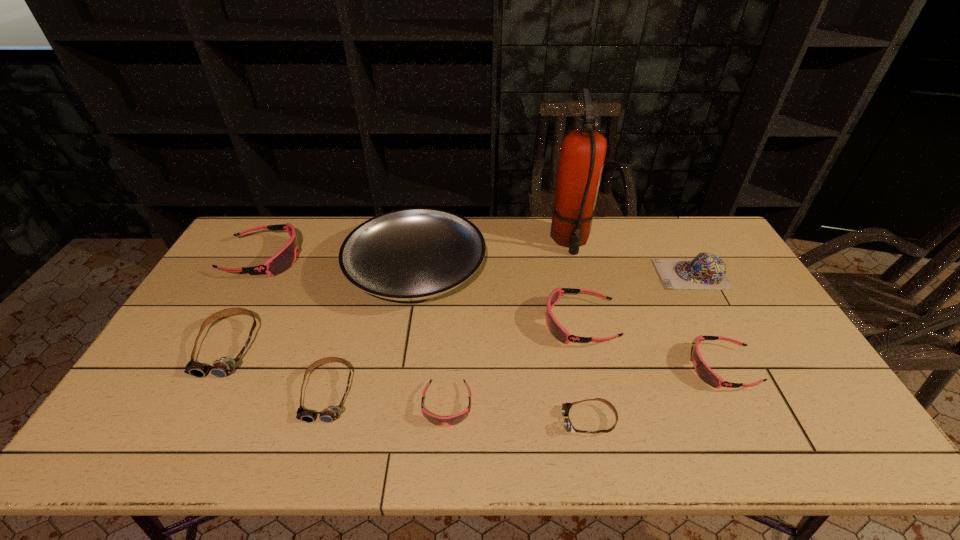
What are the coordinates of `the tallest object` in the screenshot? It's located at (583, 151).

Image resolution: width=960 pixels, height=540 pixels. I want to click on bedpan, so pyautogui.click(x=410, y=254).

In order to click on the biggest pink goggles in this screenshot , I will do tap(284, 259).

What are the coordinates of `the farthest pink goggles` in the screenshot? It's located at (284, 259).

The height and width of the screenshot is (540, 960). In order to click on cap in this screenshot , I will do `click(707, 271)`.

At what (x,y) coordinates should I click in order to perform the action: click on the third smallest pink goggles. Please return your answer as a coordinate pair (x, y). The height and width of the screenshot is (540, 960). Looking at the image, I should click on (557, 330).

Find the location of `the biggest brown goggles`. the biggest brown goggles is located at coordinates (223, 367).

Where is `the second smallest pink goggles`? the second smallest pink goggles is located at coordinates (703, 371).

At what (x,y) coordinates should I click in order to perform the action: click on the rightmost goggles. Please return your answer as a coordinate pair (x, y). This screenshot has width=960, height=540. Looking at the image, I should click on (703, 371).

Identify the location of the fifth goggles from right to left. Image resolution: width=960 pixels, height=540 pixels. (331, 413).